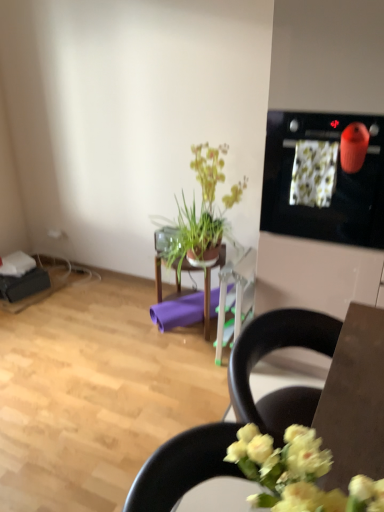
What are the coordinates of `free space in front of wooden table at center` in the screenshot? It's located at (174, 364).